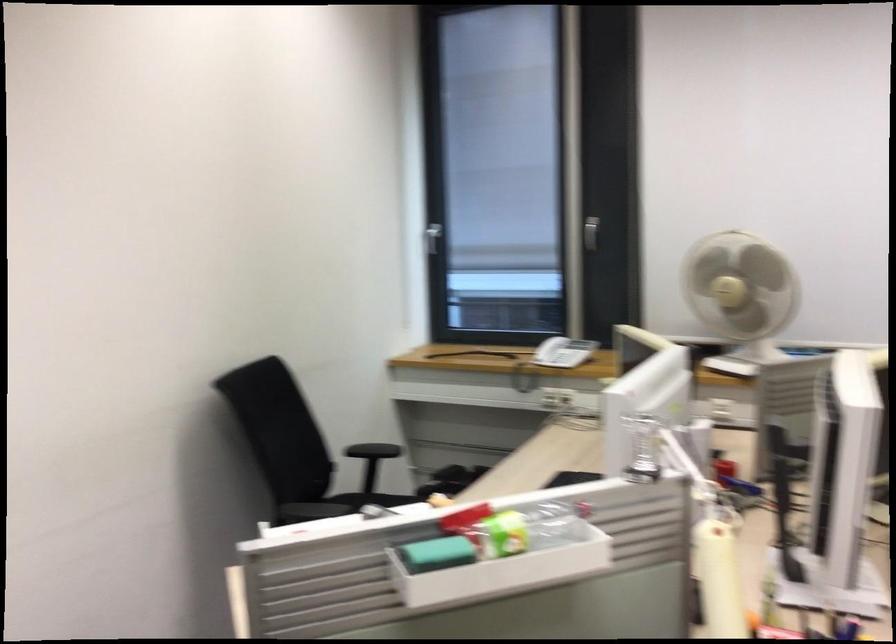
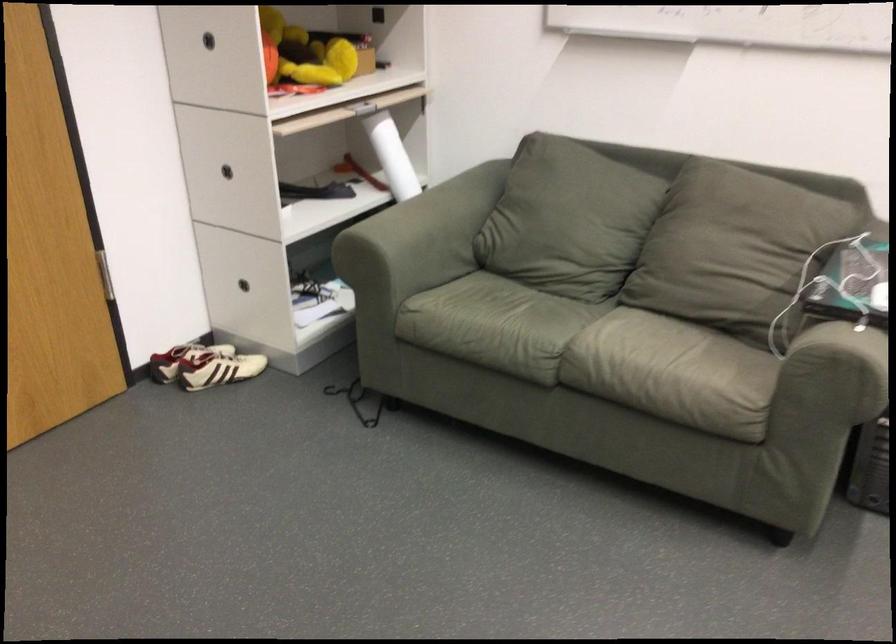
The images are taken continuously from a first-person perspective. In which direction is your viewpoint rotating?

The camera rotated toward left-down.